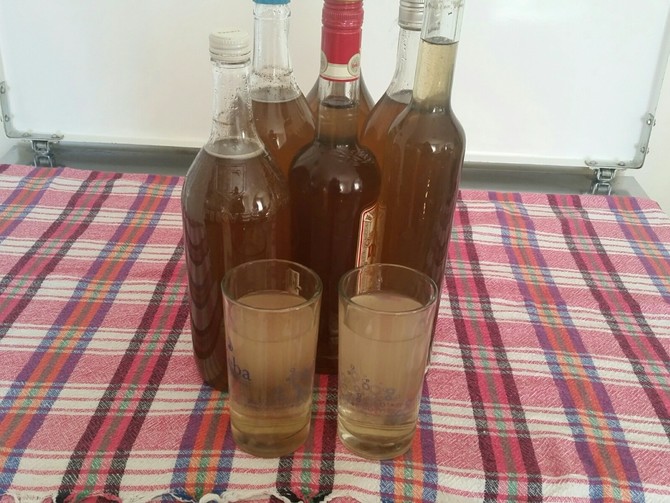
I want to click on checker pattern cloth, so click(x=494, y=337).